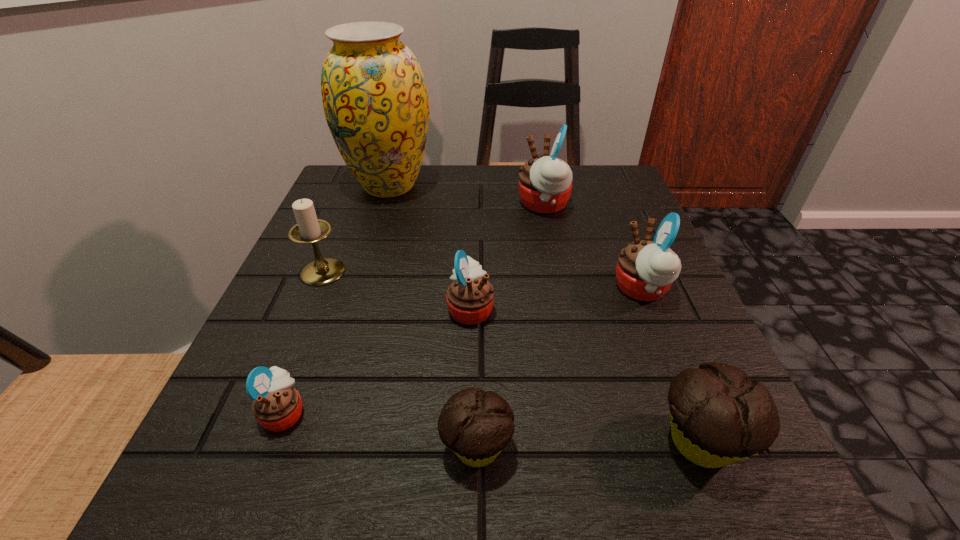
You are a GUI agent. You are given a task and a screenshot of the screen. Output one action in this format:
    pyautogui.click(x=<x>, y=<y>)
    Task: Click on the vacant area that satisfies the following two spatial constraints: 1. on the front-facing side of the third muffin from right to left; 2. on the right side of the bigger chocolate muffin
    
    Given the screenshot: What is the action you would take?
    pyautogui.click(x=591, y=441)